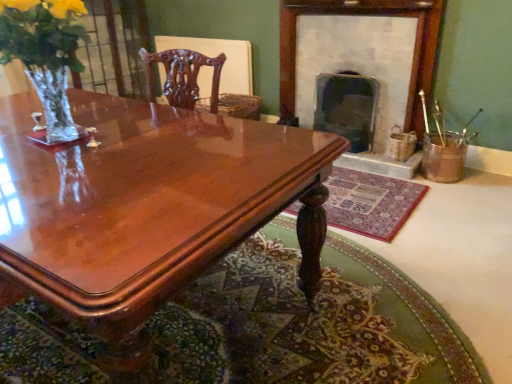
Question: Is the depth of dark gray stone fireplace at center, acting as the 2th fireplace starting from the left, less than that of carpeted mat at lower center, the 1th mat from the top?

Choices:
 (A) no
 (B) yes

Answer: (A)

Question: From the image's perspective, is dark gray stone fireplace at center, arranged as the first fireplace when viewed from the right, located beneath carpeted mat at lower center, the 1th mat from the top?

Choices:
 (A) no
 (B) yes

Answer: (A)

Question: From a real-world perspective, is dark gray stone fireplace at center, acting as the 2th fireplace starting from the left, on carpeted mat at lower center, the second mat from the bottom?

Choices:
 (A) no
 (B) yes

Answer: (B)

Question: Considering the relative sizes of dark gray stone fireplace at center, acting as the 2th fireplace starting from the left, and carpeted mat at lower center, the 1th mat from the top, in the image provided, is dark gray stone fireplace at center, acting as the 2th fireplace starting from the left, thinner than carpeted mat at lower center, the 1th mat from the top,?

Choices:
 (A) no
 (B) yes

Answer: (B)

Question: Does dark gray stone fireplace at center, acting as the 2th fireplace starting from the left, have a larger size compared to carpeted mat at lower center, the 1th mat from the top?

Choices:
 (A) no
 (B) yes

Answer: (B)

Question: Are dark gray stone fireplace at center, arranged as the first fireplace when viewed from the right, and carpeted mat at lower center, the second mat from the bottom, located far from each other?

Choices:
 (A) no
 (B) yes

Answer: (A)

Question: From the image's perspective, would you say mahogany wood chair at upper center is shown under carpeted rug at center, marked as the first mat in a bottom-to-top arrangement?

Choices:
 (A) yes
 (B) no

Answer: (B)

Question: Is mahogany wood chair at upper center to the left of carpeted rug at center, positioned as the second mat in top-to-bottom order, from the viewer's perspective?

Choices:
 (A) no
 (B) yes

Answer: (B)

Question: Is mahogany wood chair at upper center facing towards carpeted rug at center, marked as the first mat in a bottom-to-top arrangement?

Choices:
 (A) no
 (B) yes

Answer: (A)

Question: Does mahogany wood chair at upper center have a smaller size compared to carpeted rug at center, positioned as the second mat in top-to-bottom order?

Choices:
 (A) no
 (B) yes

Answer: (B)

Question: Considering the relative sizes of mahogany wood chair at upper center and carpeted rug at center, positioned as the second mat in top-to-bottom order, in the image provided, is mahogany wood chair at upper center wider than carpeted rug at center, positioned as the second mat in top-to-bottom order,?

Choices:
 (A) yes
 (B) no

Answer: (B)

Question: Is mahogany wood chair at upper center thinner than carpeted rug at center, marked as the first mat in a bottom-to-top arrangement?

Choices:
 (A) no
 (B) yes

Answer: (B)

Question: Is clear glass vase at left surrounding dark gray stone fireplace at center, acting as the 2th fireplace starting from the left?

Choices:
 (A) yes
 (B) no

Answer: (B)